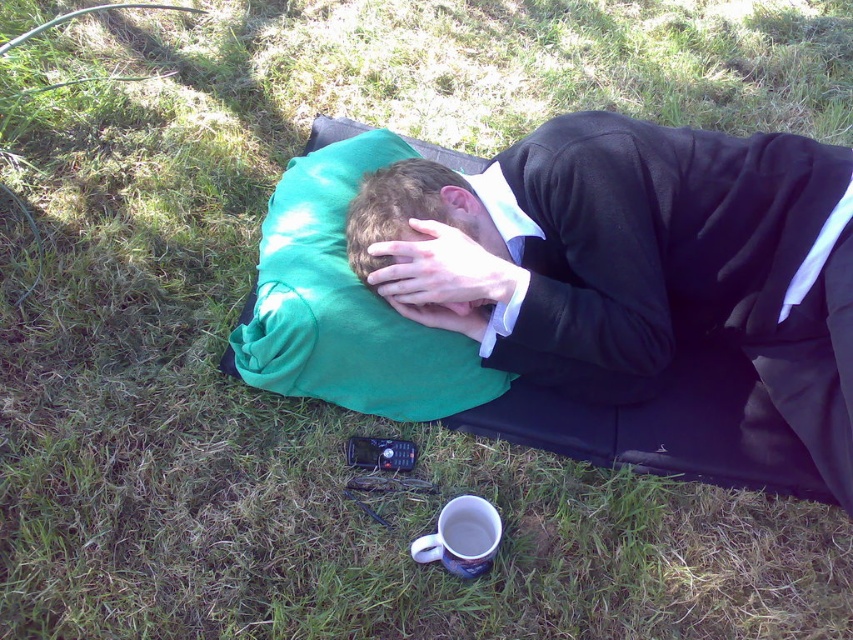
Is point (396, 364) closer to viewer compared to point (444, 515)?

No, (396, 364) is behind (444, 515).

Find the location of a particular element. Image resolution: width=853 pixels, height=640 pixels. green fabric pillow at center is located at coordinates (344, 305).

Is matte black jacket at center smaller than white ceramic mug at lower center?

Incorrect, matte black jacket at center is not smaller in size than white ceramic mug at lower center.

Who is higher up, matte black jacket at center or white ceramic mug at lower center?

matte black jacket at center

Which is in front, point (775, 364) or point (422, 563)?

Point (422, 563)

Locate an element on the screen. The image size is (853, 640). matte black jacket at center is located at coordinates (633, 260).

You are a GUI agent. You are given a task and a screenshot of the screen. Output one action in this format:
    pyautogui.click(x=<x>, y=<y>)
    Task: Click on the matte black jacket at center
    The width and height of the screenshot is (853, 640).
    Given the screenshot: What is the action you would take?
    pyautogui.click(x=633, y=260)

Can you confirm if matte black jacket at center is thinner than matte green pillow at center?

No, matte black jacket at center is not thinner than matte green pillow at center.

Where is `matte black jacket at center`? matte black jacket at center is located at coordinates (633, 260).